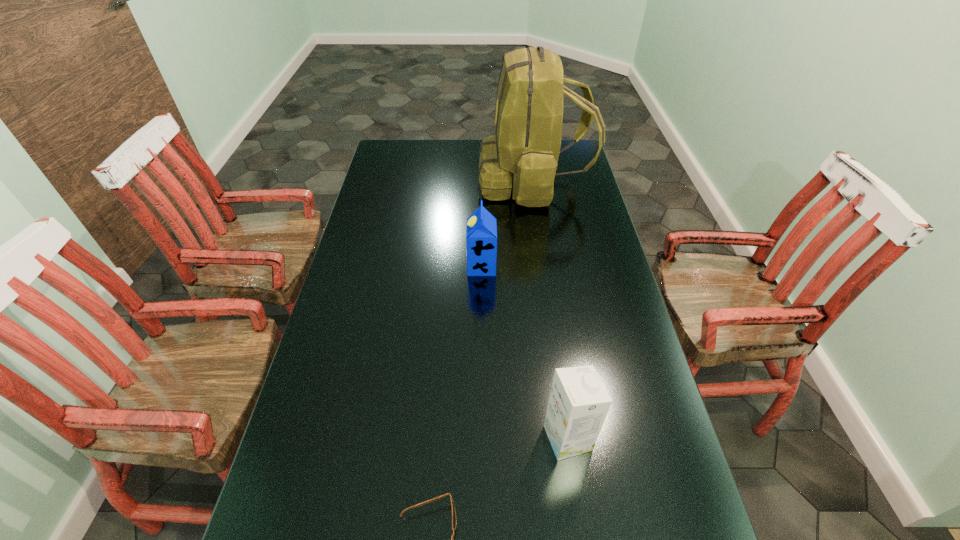
At what (x,y) coordinates should I click in order to perform the action: click on free space at the far right corner of the desktop. Please return your answer as a coordinate pair (x, y). The image size is (960, 540). Looking at the image, I should click on (563, 144).

Locate an element on the screen. vacant region between the second nearest object and the farther carton is located at coordinates (524, 352).

Locate an element on the screen. This screenshot has height=540, width=960. free space between the farther carton and the second nearest object is located at coordinates (524, 352).

Find the location of a particular element. This screenshot has width=960, height=540. free space between the backpack and the farther carton is located at coordinates (507, 223).

Find the location of a particular element. unoccupied position between the right carton and the farthest object is located at coordinates (550, 309).

The image size is (960, 540). What are the coordinates of `free point between the nearer carton and the farther carton` in the screenshot? It's located at (524, 352).

The height and width of the screenshot is (540, 960). I want to click on vacant space that is in between the tallest object and the right carton, so click(550, 309).

At what (x,y) coordinates should I click in order to perform the action: click on vacant space in between the tallest object and the left carton. Please return your answer as a coordinate pair (x, y). Image resolution: width=960 pixels, height=540 pixels. Looking at the image, I should click on (507, 223).

The height and width of the screenshot is (540, 960). I want to click on free space that is in between the third farthest object and the backpack, so click(550, 309).

The height and width of the screenshot is (540, 960). Find the location of `object that can be found as the second closest to the tallest object`. object that can be found as the second closest to the tallest object is located at coordinates (578, 404).